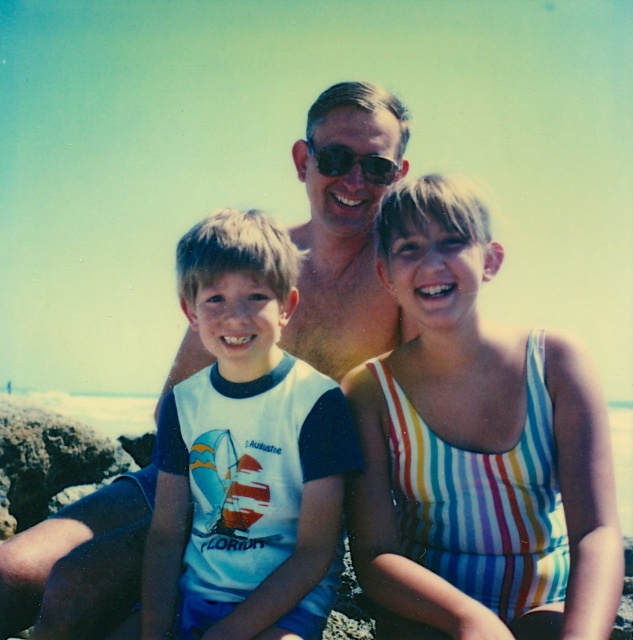
Does white matte t-shirt at center have a lesser height compared to black plastic sunglasses at center?

No, white matte t-shirt at center is not shorter than black plastic sunglasses at center.

At what (x,y) coordinates should I click in order to perform the action: click on white matte t-shirt at center. Please return your answer as a coordinate pair (x, y). This screenshot has width=633, height=640. Looking at the image, I should click on (244, 452).

Between point (272, 392) and point (399, 170), which one is positioned in front?

Point (272, 392) is more forward.

Locate an element on the screen. The height and width of the screenshot is (640, 633). white matte t-shirt at center is located at coordinates (244, 452).

Does striped fabric swimsuit at center have a lesser width compared to white matte t-shirt at center?

In fact, striped fabric swimsuit at center might be wider than white matte t-shirt at center.

Between striped fabric swimsuit at center and white matte t-shirt at center, which one is positioned higher?

striped fabric swimsuit at center is higher up.

Is point (356, 538) behind point (232, 561)?

Yes, it is behind point (232, 561).

What are the coordinates of `striped fabric swimsuit at center` in the screenshot? It's located at (477, 445).

Does striped fabric swimsuit at center have a greater width compared to black plastic sunglasses at center?

Yes, striped fabric swimsuit at center is wider than black plastic sunglasses at center.

Between point (494, 496) and point (318, 161), which one is positioned in front?

Point (494, 496) is more forward.

Where is `striped fabric swimsuit at center`? This screenshot has width=633, height=640. striped fabric swimsuit at center is located at coordinates coord(477,445).